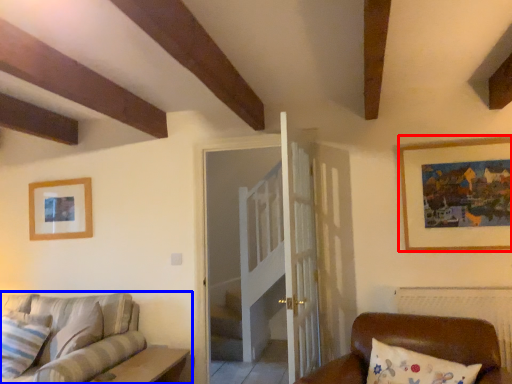
Question: Which point is further to the camera, picture frame (highlighted by a red box) or studio couch (highlighted by a blue box)?

Choices:
 (A) picture frame
 (B) studio couch

Answer: (A)